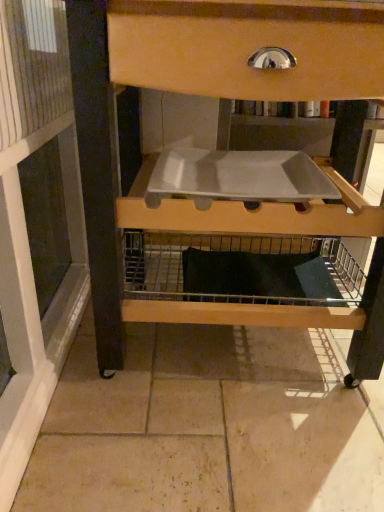
The height and width of the screenshot is (512, 384). What do you see at coordinates (238, 177) in the screenshot?
I see `white plastic tray at center` at bounding box center [238, 177].

Find the location of a particular element. This screenshot has height=512, width=384. white plastic tray at center is located at coordinates (238, 177).

I want to click on wooden drawer at upper center, so 224,166.

This screenshot has height=512, width=384. What do you see at coordinates (224, 166) in the screenshot?
I see `wooden drawer at upper center` at bounding box center [224, 166].

You are a GUI agent. You are given a task and a screenshot of the screen. Output one action in this format:
    pyautogui.click(x=<x>, y=<y>)
    Task: Click on the white plastic tray at center
    The image size is (384, 512).
    Given the screenshot: What is the action you would take?
    pyautogui.click(x=238, y=177)

Which is more to the left, wooden drawer at upper center or white plastic tray at center?

white plastic tray at center.

Who is more distant, wooden drawer at upper center or white plastic tray at center?

white plastic tray at center.

Is point (223, 254) closer to viewer compared to point (285, 164)?

No, (223, 254) is further to viewer.

Consider the image. From the image's perspective, relative to white plastic tray at center, is wooden drawer at upper center above or below?

wooden drawer at upper center is below white plastic tray at center.

From a real-world perspective, is wooden drawer at upper center located beneath white plastic tray at center?

Yes, from a real-world perspective, wooden drawer at upper center is below white plastic tray at center.

Is wooden drawer at upper center wider or thinner than white plastic tray at center?

In the image, wooden drawer at upper center appears to be wider than white plastic tray at center.

Considering the relative sizes of wooden drawer at upper center and white plastic tray at center in the image provided, is wooden drawer at upper center shorter than white plastic tray at center?

Incorrect, the height of wooden drawer at upper center does not fall short of that of white plastic tray at center.

Does wooden drawer at upper center have a larger size compared to white plastic tray at center?

Indeed, wooden drawer at upper center has a larger size compared to white plastic tray at center.

Could white plastic tray at center be considered to be inside wooden drawer at upper center?

Yes, white plastic tray at center can be found within wooden drawer at upper center.

Would you say wooden drawer at upper center is a long distance from white plastic tray at center?

They are positioned close to each other.

Is wooden drawer at upper center turned away from white plastic tray at center?

Absolutely, wooden drawer at upper center is directed away from white plastic tray at center.

You are a GUI agent. You are given a task and a screenshot of the screen. Output one action in this format:
    pyautogui.click(x=<x>, y=<y>)
    Task: Click on the sink lying above the wooden drawer at upper center (from the image's perspective)
    This screenshot has width=384, height=512.
    Given the screenshot: What is the action you would take?
    pyautogui.click(x=238, y=177)

Which is more to the left, white plastic tray at center or wooden drawer at upper center?

From the viewer's perspective, white plastic tray at center appears more on the left side.

Is white plastic tray at center positioned in front of wooden drawer at upper center?

No, white plastic tray at center is further to the viewer.

Considering the positions of points (196, 205) and (183, 12), is point (196, 205) farther from camera compared to point (183, 12)?

Yes, point (196, 205) is farther from viewer.

From the image's perspective, which one is positioned higher, white plastic tray at center or wooden drawer at upper center?

white plastic tray at center appears higher in the image.

From a real-world perspective, is white plastic tray at center physically located above or below wooden drawer at upper center?

white plastic tray at center is above wooden drawer at upper center.

Based on the photo, which object is thinner, white plastic tray at center or wooden drawer at upper center?

white plastic tray at center is thinner.

Consider the image. From their relative heights in the image, would you say white plastic tray at center is taller or shorter than wooden drawer at upper center?

Clearly, white plastic tray at center is shorter compared to wooden drawer at upper center.

Does white plastic tray at center have a larger size compared to wooden drawer at upper center?

Incorrect, white plastic tray at center is not larger than wooden drawer at upper center.

Which is correct: white plastic tray at center is inside wooden drawer at upper center, or outside of it?

white plastic tray at center is contained in wooden drawer at upper center.

Are white plastic tray at center and wooden drawer at upper center far apart?

No.

Does white plastic tray at center turn towards wooden drawer at upper center?

Yes, white plastic tray at center faces towards wooden drawer at upper center.

Can you tell me how much white plastic tray at center and wooden drawer at upper center differ in facing direction?

The facing directions of white plastic tray at center and wooden drawer at upper center are 93 degrees apart.

At what (x,y) coordinates should I click in order to perform the action: click on sink behind the wooden drawer at upper center. Please return your answer as a coordinate pair (x, y). The height and width of the screenshot is (512, 384). Looking at the image, I should click on (238, 177).

I want to click on furniture lying below the white plastic tray at center (from the image's perspective), so click(224, 166).

The image size is (384, 512). What are the coordinates of `sink lying behind the wooden drawer at upper center` in the screenshot? It's located at (238, 177).